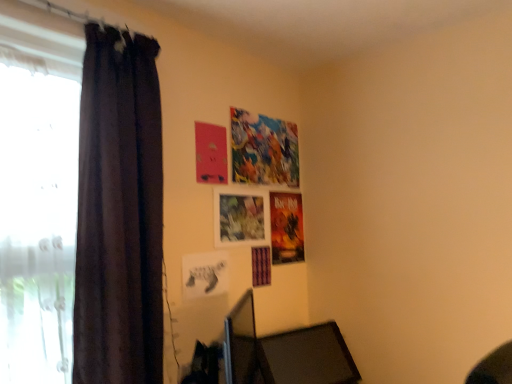
Question: Would you say dark fabric curtain at left is inside or outside white sheer curtain at left?

Choices:
 (A) outside
 (B) inside

Answer: (B)

Question: Is dark fabric curtain at left wider or thinner than white sheer curtain at left?

Choices:
 (A) thin
 (B) wide

Answer: (A)

Question: Estimate the real-world distances between objects in this image. Which object is closer to the dark fabric curtain at left?

Choices:
 (A) white sheer curtain at left
 (B) black matte picture frame at center
 (C) matte paper poster at upper center

Answer: (A)

Question: Which object is the closest to the matte paper poster at upper center?

Choices:
 (A) white sheer curtain at left
 (B) black matte picture frame at center
 (C) dark fabric curtain at left

Answer: (B)